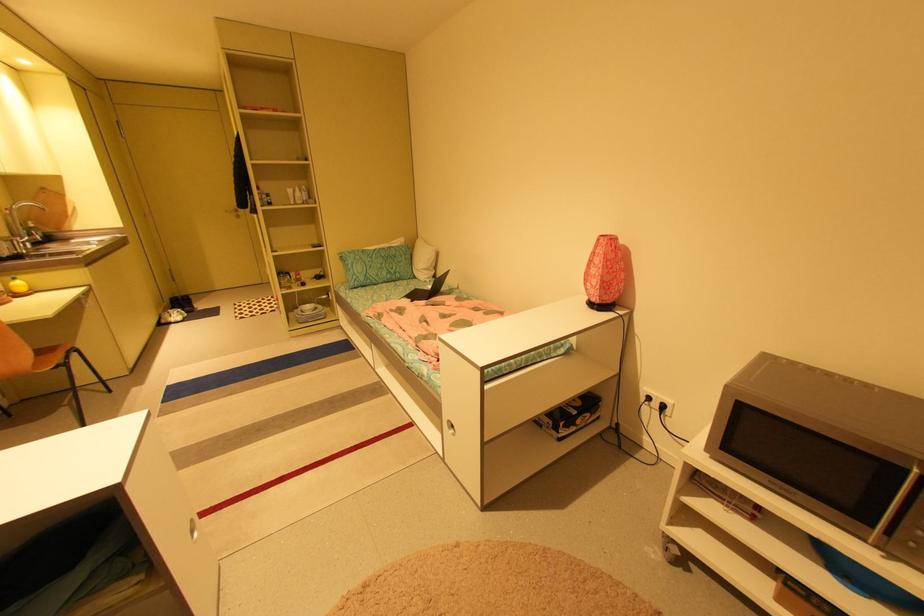
At what (x,y) coordinates should I click in order to perform the action: click on orange chair seat. Please return your answer as a coordinate pair (x, y). Looking at the image, I should click on (46, 355).